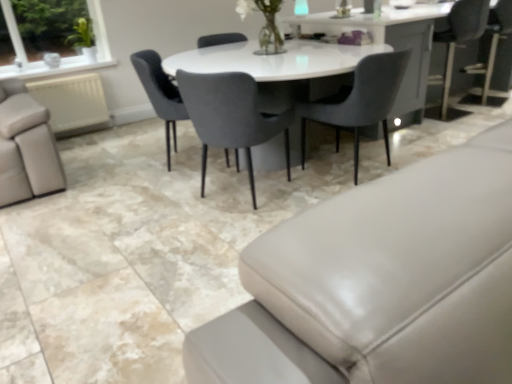
Describe the element at coordinates (380, 282) in the screenshot. I see `matte gray couch at lower right` at that location.

The height and width of the screenshot is (384, 512). Describe the element at coordinates (231, 116) in the screenshot. I see `velvet grey chair at center, acting as the second chair starting from the left` at that location.

Where is `velvet grey chair at center, which is the first chair in right-to-left order`? Image resolution: width=512 pixels, height=384 pixels. velvet grey chair at center, which is the first chair in right-to-left order is located at coordinates (360, 101).

Looking at this image, measure the distance between clear glass vase at upper center and camera.

2.80 meters.

Measure the distance between matte gray chair at center, which appears as the first chair when viewed from the left, and camera.

matte gray chair at center, which appears as the first chair when viewed from the left, and camera are 8.44 feet apart from each other.

This screenshot has width=512, height=384. In order to click on matte gray couch at lower right in this screenshot , I will do `click(380, 282)`.

From the image's perspective, between matte gray chair at center, which appears as the first chair when viewed from the left, and velvet grey chair at center, acting as the second chair starting from the left, who is located below?

velvet grey chair at center, acting as the second chair starting from the left, is shown below in the image.

Who is more distant, matte gray chair at center, which is counted as the 3th chair, starting from the right, or velvet grey chair at center, marked as the 2th chair in a right-to-left arrangement?

matte gray chair at center, which is counted as the 3th chair, starting from the right, is further from the camera.

Can you confirm if matte gray chair at center, which is counted as the 3th chair, starting from the right, is smaller than velvet grey chair at center, acting as the second chair starting from the left?

Yes, matte gray chair at center, which is counted as the 3th chair, starting from the right, is smaller than velvet grey chair at center, acting as the second chair starting from the left.

Is point (225, 151) less distant than point (251, 85)?

No, it is not.

Measure the distance between matte gray couch at lower right and velvet grey chair at center, which is the first chair in right-to-left order.

matte gray couch at lower right is 1.81 meters from velvet grey chair at center, which is the first chair in right-to-left order.

From the image's perspective, is matte gray couch at lower right above or below velvet grey chair at center, the 3th chair in the left-to-right sequence?

From the image's perspective, matte gray couch at lower right appears below velvet grey chair at center, the 3th chair in the left-to-right sequence.

From a real-world perspective, which is physically above, matte gray couch at lower right or velvet grey chair at center, which is the first chair in right-to-left order?

In real-world perspective, velvet grey chair at center, which is the first chair in right-to-left order, is above.

Considering the positions of objects matte gray couch at lower right and velvet grey chair at center, the 3th chair in the left-to-right sequence, in the image provided, who is behind, matte gray couch at lower right or velvet grey chair at center, the 3th chair in the left-to-right sequence,?

velvet grey chair at center, the 3th chair in the left-to-right sequence, is more distant.

Is point (268, 126) more distant than point (364, 83)?

That is True.

From their relative heights in the image, would you say velvet grey chair at center, marked as the 2th chair in a right-to-left arrangement, is taller or shorter than velvet grey chair at center, the 3th chair in the left-to-right sequence?

velvet grey chair at center, marked as the 2th chair in a right-to-left arrangement, is taller than velvet grey chair at center, the 3th chair in the left-to-right sequence.

Looking at this image, is velvet grey chair at center, marked as the 2th chair in a right-to-left arrangement, at the right side of velvet grey chair at center, which is the first chair in right-to-left order?

In fact, velvet grey chair at center, marked as the 2th chair in a right-to-left arrangement, is to the left of velvet grey chair at center, which is the first chair in right-to-left order.

Is matte gray couch at lower right facing away from velvet grey chair at center, acting as the second chair starting from the left?

That's not correct — matte gray couch at lower right is not looking away from velvet grey chair at center, acting as the second chair starting from the left.

Which is more to the right, matte gray couch at lower right or velvet grey chair at center, acting as the second chair starting from the left?

matte gray couch at lower right.

From the image's perspective, which one is positioned lower, matte gray couch at lower right or velvet grey chair at center, acting as the second chair starting from the left?

From the image's view, velvet grey chair at center, acting as the second chair starting from the left, is below.

Is clear glass vase at upper center aimed at matte gray couch at lower right?

No, clear glass vase at upper center is not aimed at matte gray couch at lower right.

Can you tell me how much clear glass vase at upper center and matte gray couch at lower right differ in facing direction?

89.9 degrees separate the facing orientations of clear glass vase at upper center and matte gray couch at lower right.

Is clear glass vase at upper center inside or outside of matte gray couch at lower right?

clear glass vase at upper center is not enclosed by matte gray couch at lower right.

The image size is (512, 384). Identify the location of studio couch that is on the right side of clear glass vase at upper center. (380, 282).

Are velvet grey chair at center, the 3th chair in the left-to-right sequence, and matte gray chair at center, which is counted as the 3th chair, starting from the right, far apart?

Yes, velvet grey chair at center, the 3th chair in the left-to-right sequence, is far from matte gray chair at center, which is counted as the 3th chair, starting from the right.

Which object is positioned more to the left, velvet grey chair at center, the 3th chair in the left-to-right sequence, or matte gray chair at center, which appears as the first chair when viewed from the left?

Positioned to the left is matte gray chair at center, which appears as the first chair when viewed from the left.

Is point (382, 61) closer or farther from the camera than point (170, 114)?

Point (382, 61) appears to be closer to the viewer than point (170, 114).

From a real-world perspective, is velvet grey chair at center, which is the first chair in right-to-left order, located beneath matte gray chair at center, which is counted as the 3th chair, starting from the right?

Yes, from a real-world perspective, velvet grey chair at center, which is the first chair in right-to-left order, is beneath matte gray chair at center, which is counted as the 3th chair, starting from the right.

Looking at this image, which is more to the right, velvet grey chair at center, which is the first chair in right-to-left order, or velvet grey chair at center, marked as the 2th chair in a right-to-left arrangement?

From the viewer's perspective, velvet grey chair at center, which is the first chair in right-to-left order, appears more on the right side.

Consider the image. Does velvet grey chair at center, which is the first chair in right-to-left order, have a lesser height compared to velvet grey chair at center, marked as the 2th chair in a right-to-left arrangement?

Yes.

Considering the sizes of objects velvet grey chair at center, which is the first chair in right-to-left order, and velvet grey chair at center, acting as the second chair starting from the left, in the image provided, who is wider, velvet grey chair at center, which is the first chair in right-to-left order, or velvet grey chair at center, acting as the second chair starting from the left,?

Wider between the two is velvet grey chair at center, which is the first chair in right-to-left order.

Looking at the image, does velvet grey chair at center, which is the first chair in right-to-left order, seem bigger or smaller compared to velvet grey chair at center, marked as the 2th chair in a right-to-left arrangement?

Clearly, velvet grey chair at center, which is the first chair in right-to-left order, is smaller in size than velvet grey chair at center, marked as the 2th chair in a right-to-left arrangement.

Locate an element on the screen. This screenshot has width=512, height=384. chair that is the 2nd one when counting backward from the velvet grey chair at center, acting as the second chair starting from the left is located at coordinates (160, 93).

Where is `studio couch below the velvet grey chair at center, which is the first chair in right-to-left order (from a real-world perspective)`? The height and width of the screenshot is (384, 512). studio couch below the velvet grey chair at center, which is the first chair in right-to-left order (from a real-world perspective) is located at coordinates (380, 282).

Based on their spatial positions, is velvet grey chair at center, which is the first chair in right-to-left order, or matte gray chair at center, which is counted as the 3th chair, starting from the right, further from velvet grey chair at center, marked as the 2th chair in a right-to-left arrangement?

velvet grey chair at center, which is the first chair in right-to-left order, lies further to velvet grey chair at center, marked as the 2th chair in a right-to-left arrangement, than the other object.

Based on the photo, which object lies further to the anchor point matte gray chair at center, which appears as the first chair when viewed from the left, velvet grey chair at center, marked as the 2th chair in a right-to-left arrangement, or matte gray couch at lower right?

matte gray couch at lower right is further to matte gray chair at center, which appears as the first chair when viewed from the left.

Looking at the image, which one is located further to matte gray chair at center, which is counted as the 3th chair, starting from the right, matte gray couch at lower right or velvet grey chair at center, acting as the second chair starting from the left?

matte gray couch at lower right is further to matte gray chair at center, which is counted as the 3th chair, starting from the right.

Looking at the image, which one is located further to matte gray chair at center, which appears as the first chair when viewed from the left, velvet grey chair at center, acting as the second chair starting from the left, or clear glass vase at upper center?

clear glass vase at upper center is positioned further to the anchor matte gray chair at center, which appears as the first chair when viewed from the left.

Based on their spatial positions, is velvet grey chair at center, the 3th chair in the left-to-right sequence, or velvet grey chair at center, marked as the 2th chair in a right-to-left arrangement, closer to matte gray chair at center, which is counted as the 3th chair, starting from the right?

velvet grey chair at center, marked as the 2th chair in a right-to-left arrangement, lies closer to matte gray chair at center, which is counted as the 3th chair, starting from the right, than the other object.

Estimate the real-world distances between objects in this image. Which object is further from velvet grey chair at center, which is the first chair in right-to-left order, matte gray chair at center, which is counted as the 3th chair, starting from the right, or velvet grey chair at center, marked as the 2th chair in a right-to-left arrangement?

Among the two, matte gray chair at center, which is counted as the 3th chair, starting from the right, is located further to velvet grey chair at center, which is the first chair in right-to-left order.

Estimate the real-world distances between objects in this image. Which object is further from matte gray couch at lower right, velvet grey chair at center, the 3th chair in the left-to-right sequence, or matte gray chair at center, which appears as the first chair when viewed from the left?

Based on the image, matte gray chair at center, which appears as the first chair when viewed from the left, appears to be further to matte gray couch at lower right.

Based on their spatial positions, is clear glass vase at upper center or velvet grey chair at center, acting as the second chair starting from the left, further from matte gray chair at center, which appears as the first chair when viewed from the left?

Based on the image, clear glass vase at upper center appears to be further to matte gray chair at center, which appears as the first chair when viewed from the left.

The height and width of the screenshot is (384, 512). In order to click on chair between matte gray couch at lower right and velvet grey chair at center, the 3th chair in the left-to-right sequence, from front to back in this screenshot , I will do `click(231, 116)`.

Locate an element on the screen. The image size is (512, 384). floral arrangement situated between matte gray chair at center, which is counted as the 3th chair, starting from the right, and velvet grey chair at center, which is the first chair in right-to-left order, from left to right is located at coordinates [264, 25].

Where is `floral arrangement located between matte gray couch at lower right and matte gray chair at center, which appears as the first chair when viewed from the left, in the depth direction`? The height and width of the screenshot is (384, 512). floral arrangement located between matte gray couch at lower right and matte gray chair at center, which appears as the first chair when viewed from the left, in the depth direction is located at coordinates (264, 25).

At what (x,y) coordinates should I click in order to perform the action: click on chair between matte gray chair at center, which appears as the first chair when viewed from the left, and velvet grey chair at center, which is the first chair in right-to-left order, in the horizontal direction. Please return your answer as a coordinate pair (x, y). The width and height of the screenshot is (512, 384). Looking at the image, I should click on (231, 116).